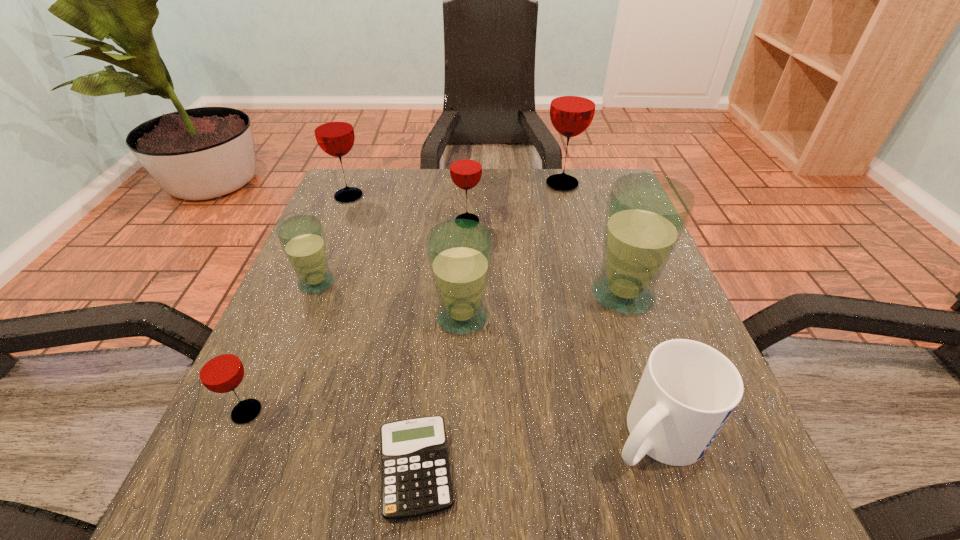
What are the coordinates of `free space located 0.180m on the right of the shortest object` in the screenshot? It's located at (589, 469).

I want to click on mug at the near edge, so click(688, 390).

The width and height of the screenshot is (960, 540). I want to click on calculator situated at the near edge, so click(x=416, y=481).

The height and width of the screenshot is (540, 960). In order to click on mug at the right edge in this screenshot , I will do `click(688, 390)`.

This screenshot has width=960, height=540. What are the coordinates of `object that is at the far left corner` in the screenshot? It's located at (333, 129).

Find the location of a particular element. object that is at the far right corner is located at coordinates (572, 108).

Locate an element on the screen. Image resolution: width=960 pixels, height=540 pixels. object that is positioned at the near right corner is located at coordinates point(688,390).

The width and height of the screenshot is (960, 540). In order to click on vacant space at the far edge of the desktop in this screenshot , I will do pyautogui.click(x=563, y=219).

Image resolution: width=960 pixels, height=540 pixels. I want to click on vacant area at the left edge of the desktop, so click(342, 261).

Find the location of `free space at the right edge`. free space at the right edge is located at coordinates (601, 250).